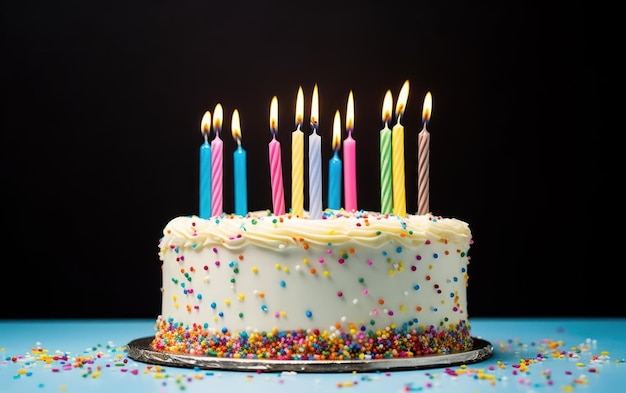
I want to click on striped candles, so click(x=216, y=174), click(x=274, y=180), click(x=317, y=174), click(x=297, y=174), click(x=384, y=168), click(x=421, y=181), click(x=398, y=180).